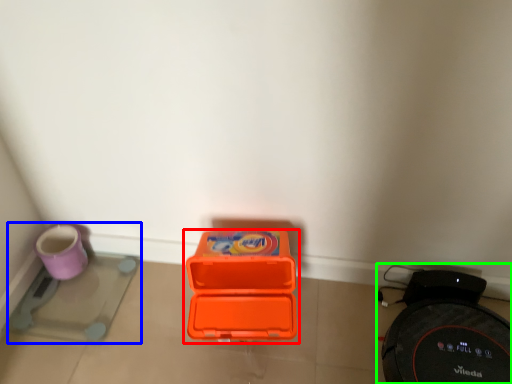
Question: Based on their relative distances, which object is nearer to box (highlighted by a red box)? Choose from appliance (highlighted by a blue box) and appliance (highlighted by a green box).

Choices:
 (A) appliance
 (B) appliance

Answer: (B)